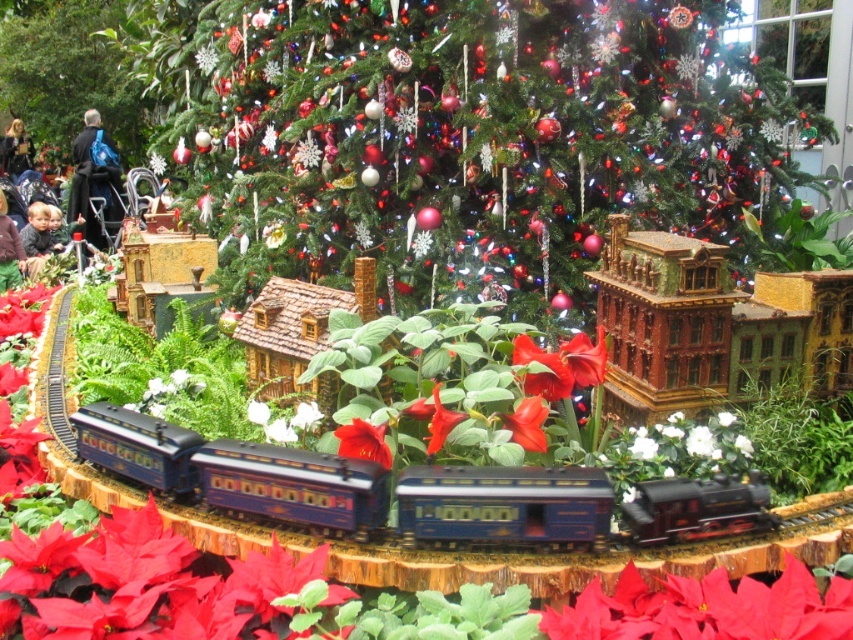
Question: Which object is positioned farthest from the green matte christmas tree at upper center?

Choices:
 (A) shiny green christmas tree at center
 (B) dark blue backpack at left
 (C) dark brown leather jacket at upper left
 (D) shiny blue train at center

Answer: (D)

Question: Does shiny green christmas tree at center have a greater width compared to shiny blue train at center?

Choices:
 (A) no
 (B) yes

Answer: (B)

Question: Is dark blue backpack at left wider than dark brown leather jacket at upper left?

Choices:
 (A) yes
 (B) no

Answer: (A)

Question: Which of the following is the closest to the observer?

Choices:
 (A) (749, 509)
 (B) (15, 120)

Answer: (A)

Question: Does shiny blue train at center have a lesser width compared to dark blue backpack at left?

Choices:
 (A) yes
 (B) no

Answer: (B)

Question: Based on their relative distances, which object is nearer to the shiny blue train at center?

Choices:
 (A) green matte christmas tree at upper center
 (B) shiny green christmas tree at center

Answer: (B)